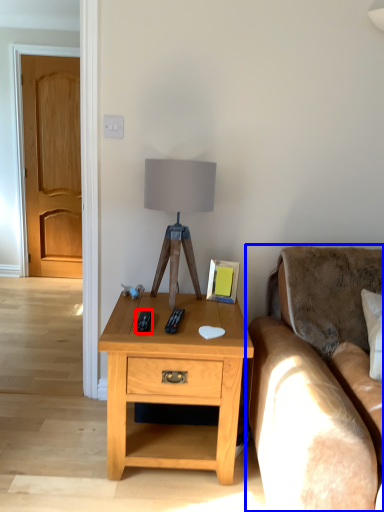
Question: Which of the following is the farthest to the observer, remote (highlighted by a red box) or studio couch (highlighted by a blue box)?

Choices:
 (A) remote
 (B) studio couch

Answer: (A)